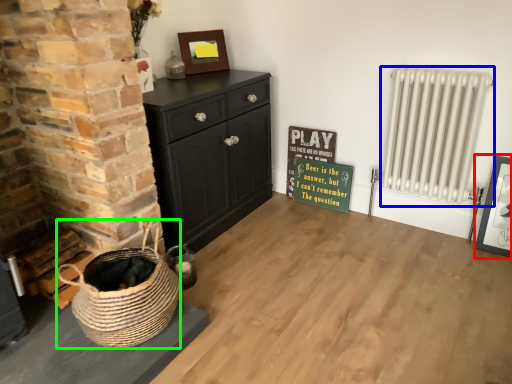
Question: Which object is positioned closest to picture frame (highlighted by a red box)? Select from radiator (highlighted by a blue box) and basket (highlighted by a green box).

Choices:
 (A) radiator
 (B) basket

Answer: (A)